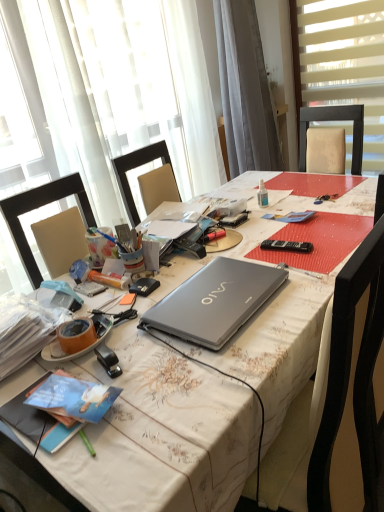
Locate an element on the screen. This screenshot has height=512, width=384. free space to the right of blue paperback book at lower left, acting as the 1th book starting from the top is located at coordinates (157, 391).